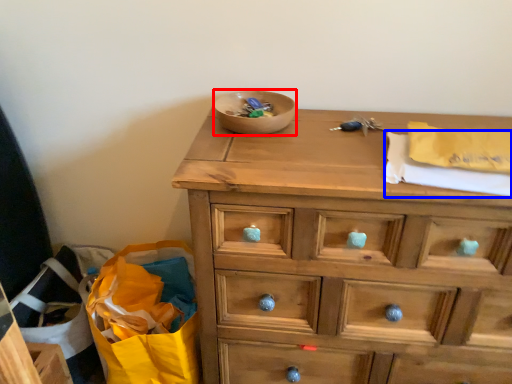
Question: Which point is further to the camera, bowl (highlighted by a red box) or clothe (highlighted by a blue box)?

Choices:
 (A) bowl
 (B) clothe

Answer: (A)